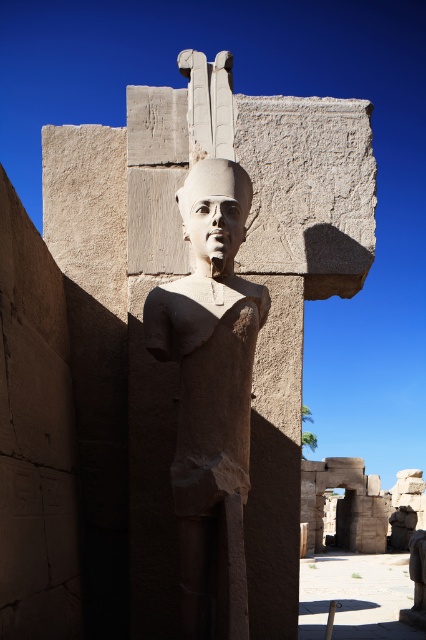
Question: Does smooth stone statue at center have a greater width compared to smooth stone head at center?

Choices:
 (A) no
 (B) yes

Answer: (B)

Question: Observing the image, what is the correct spatial positioning of smooth stone statue at center in reference to smooth stone head at center?

Choices:
 (A) left
 (B) right

Answer: (B)

Question: Which point appears closest to the camera in this image?

Choices:
 (A) (236, 204)
 (B) (331, 289)

Answer: (A)

Question: Does smooth stone statue at center have a larger size compared to smooth stone head at center?

Choices:
 (A) yes
 (B) no

Answer: (A)

Question: Which point is closer to the camera?

Choices:
 (A) smooth stone head at center
 (B) smooth stone statue at center

Answer: (A)